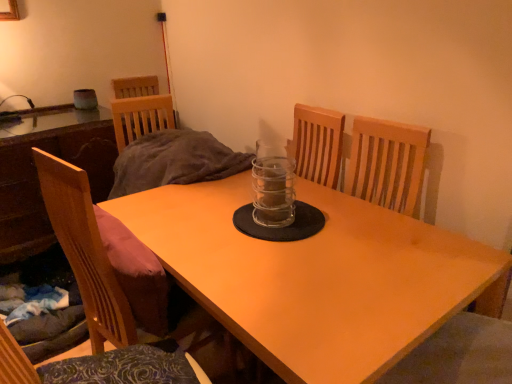
Question: Considering the relative positions of wooden table at left, which is the second table in right-to-left order, and wooden chair at left in the image provided, is wooden table at left, which is the second table in right-to-left order, to the left or to the right of wooden chair at left?

Choices:
 (A) right
 (B) left

Answer: (B)

Question: From a real-world perspective, relative to wooden chair at left, is wooden table at left, which is the second table in right-to-left order, vertically above or below?

Choices:
 (A) above
 (B) below

Answer: (A)

Question: Which object is the farthest from the wooden chair at left?

Choices:
 (A) wooden table at left, which is the second table in right-to-left order
 (B) light brown wooden table at center, which is the second table from left to right
 (C) transparent glass jar at center

Answer: (A)

Question: Which object is positioned farthest from the wooden chair at left?

Choices:
 (A) light brown wooden table at center, which is the second table from left to right
 (B) transparent glass jar at center
 (C) wooden table at left, the first table in the left-to-right sequence

Answer: (C)